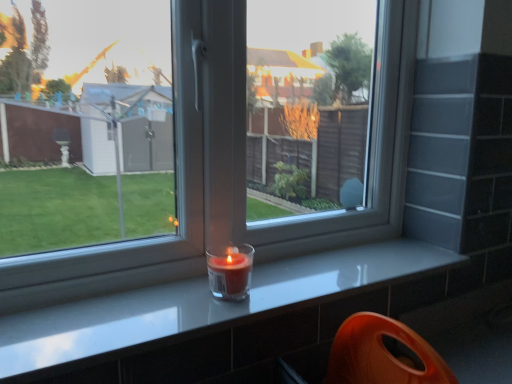
Find the location of a particular element. Image resolution: width=512 pixels, height=384 pixels. empty space that is ontop of smooth gray counter at center (from a real-world perspective) is located at coordinates (290, 268).